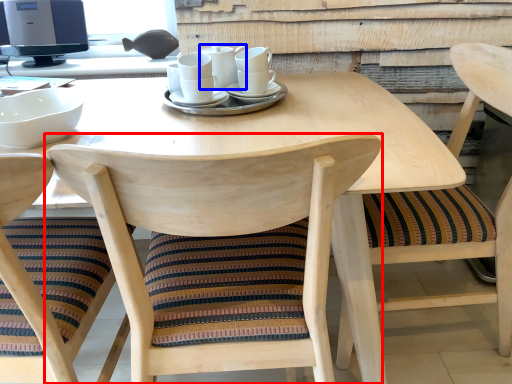
Question: Which of the following is the closest to the observer, chair (highlighted by a red box) or tableware (highlighted by a blue box)?

Choices:
 (A) chair
 (B) tableware

Answer: (A)